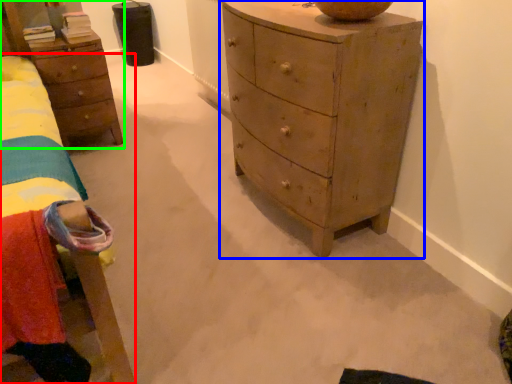
Question: Which is farther away from bed (highlighted by a red box)? chest of drawers (highlighted by a blue box) or nightstand (highlighted by a green box)?

Choices:
 (A) chest of drawers
 (B) nightstand

Answer: (A)